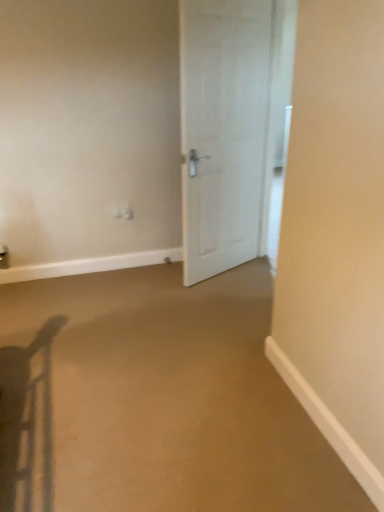
Where is `vacant space underneath white matte door at center (from a real-world perspective)`? vacant space underneath white matte door at center (from a real-world perspective) is located at coordinates (240, 266).